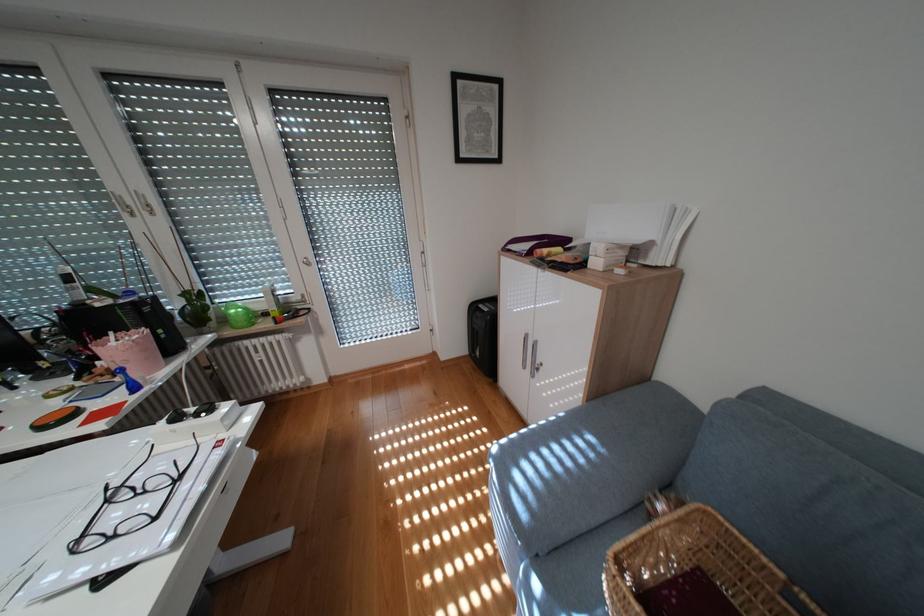
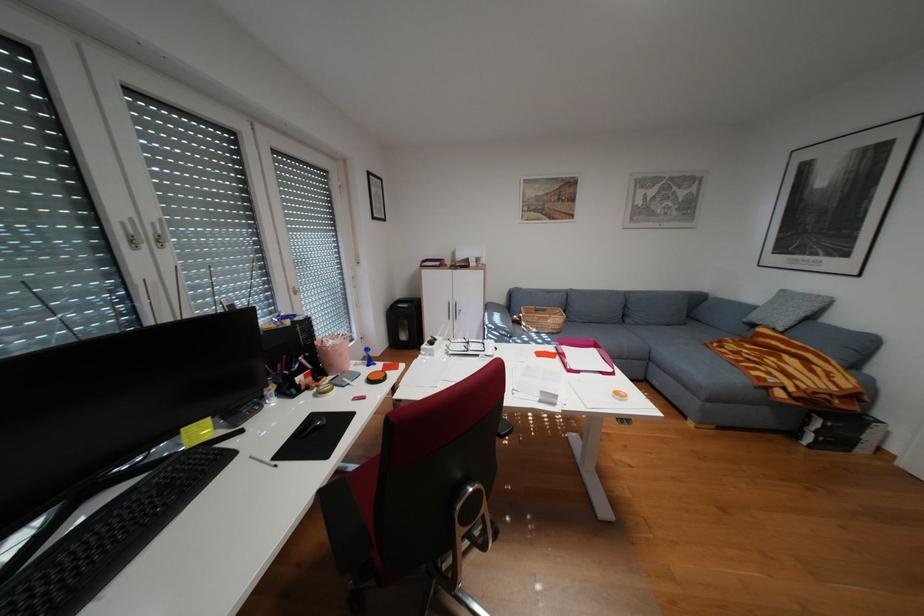
In the second image, find the point that corresponds to the point at 201,422 in the first image.

(448, 342)